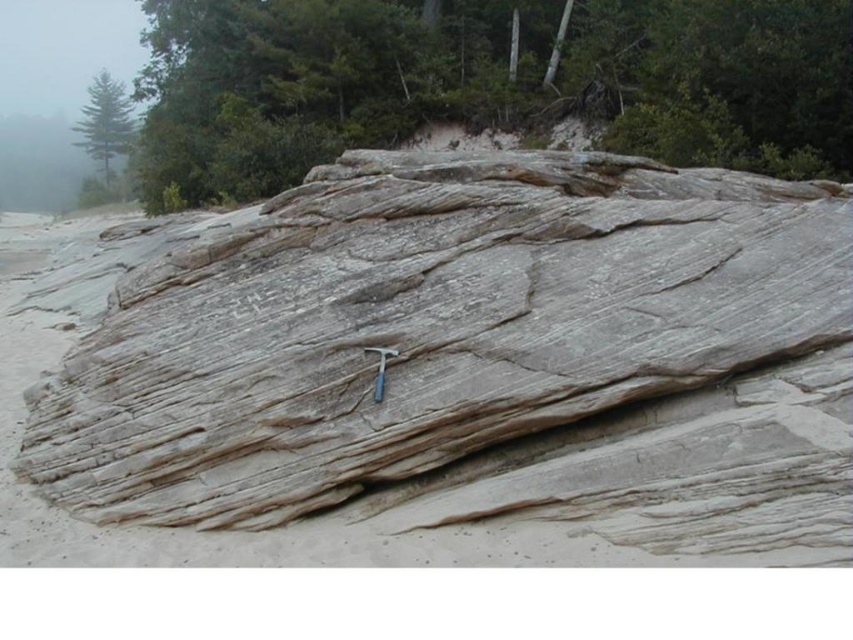
Which is in front, point (444, 419) or point (212, 35)?

Point (444, 419) is in front.

What do you see at coordinates (473, 356) in the screenshot? Image resolution: width=853 pixels, height=640 pixels. I see `gray/weathered rock at center` at bounding box center [473, 356].

Locate an element on the screen. The image size is (853, 640). gray/weathered rock at center is located at coordinates (473, 356).

Is smooth brown tree trunk at upper center above green matte tree at upper left?

Incorrect, smooth brown tree trunk at upper center is not positioned above green matte tree at upper left.

Looking at this image, between smooth brown tree trunk at upper center and green matte tree at upper left, which one has less height?

smooth brown tree trunk at upper center

The image size is (853, 640). I want to click on smooth brown tree trunk at upper center, so click(486, 81).

Is gray/weathered rock at center thinner than green matte tree at upper left?

Correct, gray/weathered rock at center's width is less than green matte tree at upper left's.

Can you confirm if gray/weathered rock at center is positioned above green matte tree at upper left?

No, gray/weathered rock at center is not above green matte tree at upper left.

Is point (456, 520) positioned in front of point (103, 77)?

That is True.

Identify the location of gray/weathered rock at center. (473, 356).